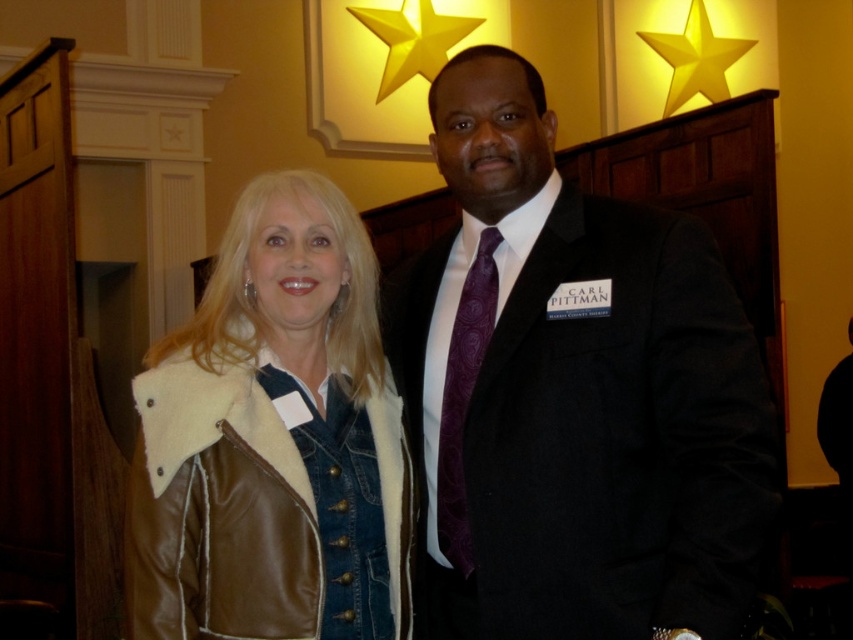
You are organizing a photo shoot and need to ensure that the two main subjects, the matte black suit at center and the brown leather jacket at center, are positioned appropriately. Based on their widths, which one should be placed on the wider side of the frame to maintain visual balance?

The matte black suit at center is wider than the brown leather jacket at center, so it should be placed on the wider side of the frame to maintain visual balance.

You are taking a photo of two people at an event. You notice two points marked in the image. The first point is at coordinates point (126, 524) and the second point is at point (672, 45). Which point is closer to the camera?

Point (126, 524) is closer to the camera than point (672, 45) according to the description.